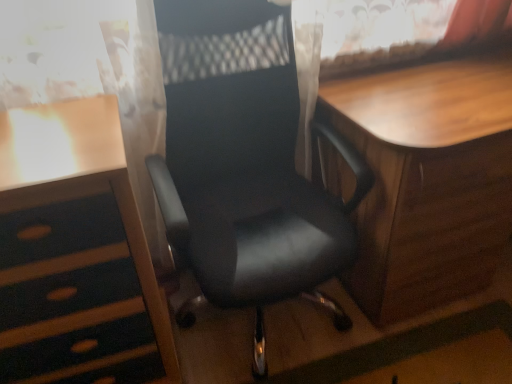
Question: Considering the relative positions of wooden desk at left and wooden table at center in the image provided, is wooden desk at left to the left or to the right of wooden table at center?

Choices:
 (A) left
 (B) right

Answer: (A)

Question: From the image's perspective, is wooden desk at left above or below wooden table at center?

Choices:
 (A) below
 (B) above

Answer: (A)

Question: Based on their relative distances, which object is nearer to the black leather chair at center?

Choices:
 (A) wooden desk at left
 (B) wooden table at center

Answer: (B)

Question: Estimate the real-world distances between objects in this image. Which object is farther from the black leather chair at center?

Choices:
 (A) wooden table at center
 (B) wooden desk at left

Answer: (B)